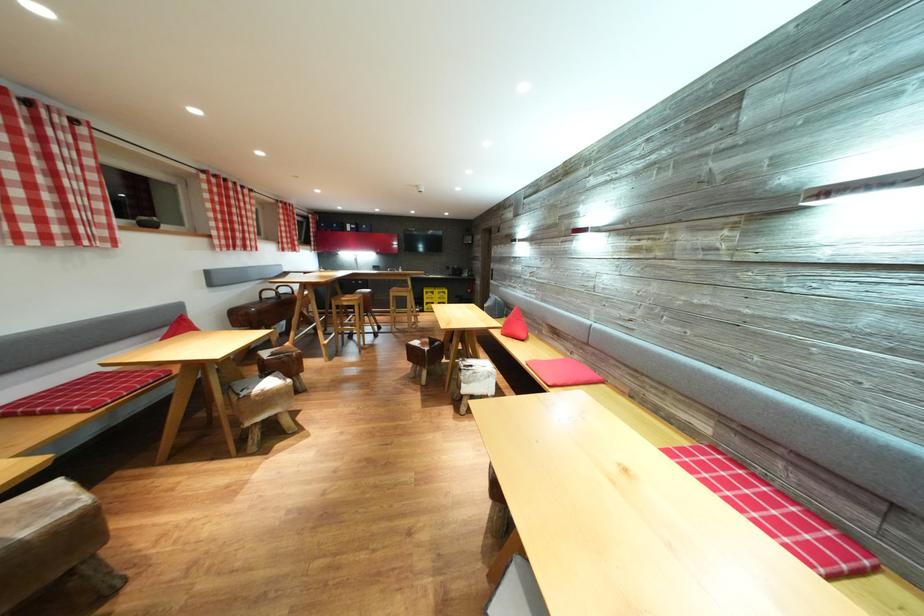
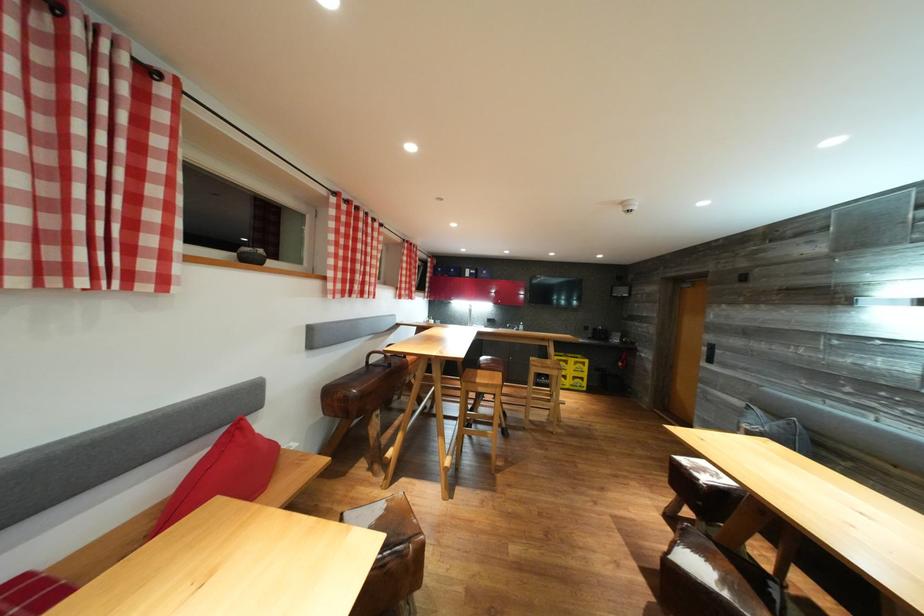
In the second image, find the point that corresponds to point (355, 306) in the first image.

(492, 391)